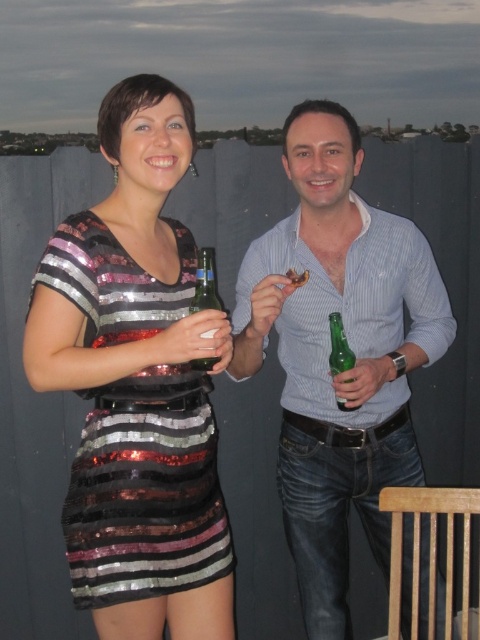
You are at a party and holding a green glass beer bottle at center. You want to hand it to a friend who is standing 5 feet away from you. Can you reach them without moving?

The green glass beer bottle at center is 5.16 feet away from the viewer. Since your friend is only 5 feet away, you can reach them by extending your arm as the distance is slightly less than the bottle is from you.

You are at a party and see two people dressed in the blue striped shirt at center and the shiny sequined dress at left. Which one is positioned lower from the ground?

The blue striped shirt at center is located below the shiny sequined dress at left, so it is positioned lower from the ground.